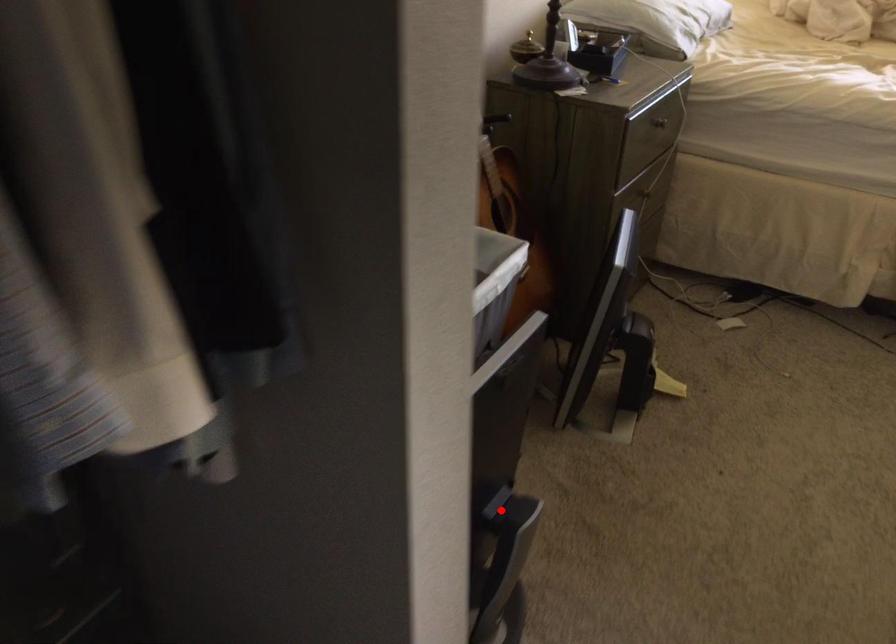
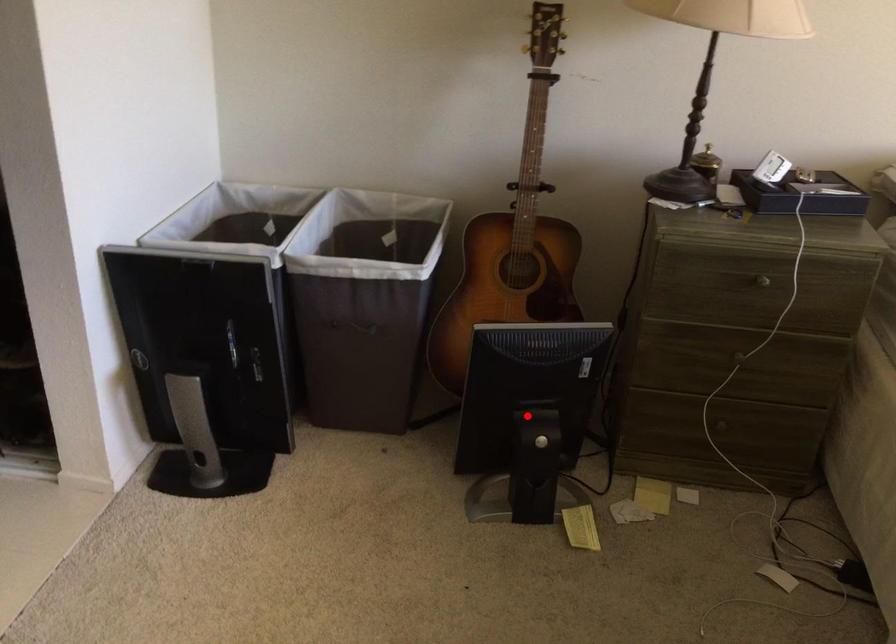
I am providing you with two images of the same scene from different viewpoints. A red point is marked on the first image and another point is marked on the second image. Does the point marked in image1 correspond to the same location as the one in image2?

No